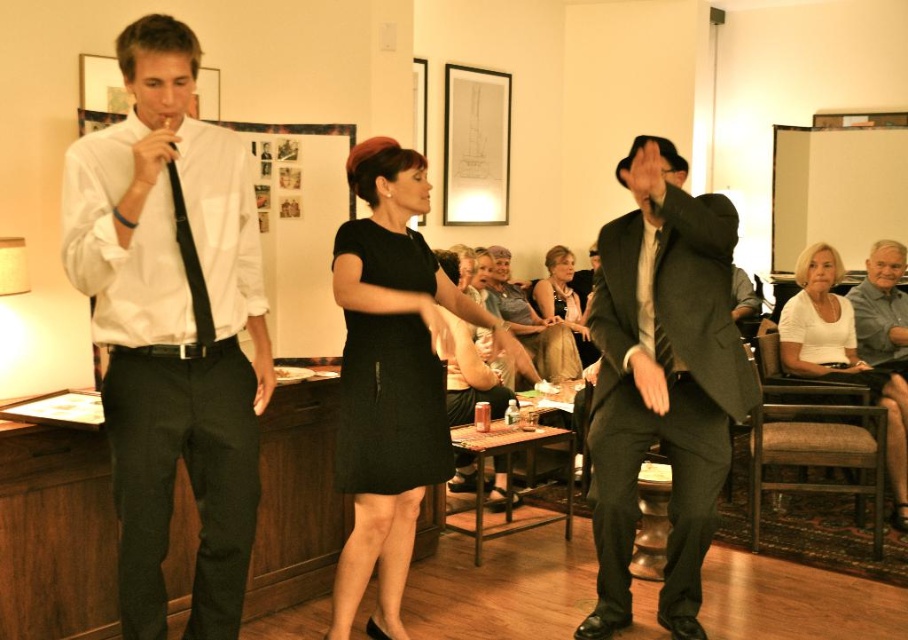
Can you confirm if black dress at center is positioned to the right of black silk tie at center?

Incorrect, black dress at center is not on the right side of black silk tie at center.

Who is more forward, (363, 307) or (655, 228)?

Point (363, 307) is more forward.

I want to click on black dress at center, so coord(391,378).

How far apart are matte black suit at center and black silk tie at center?

matte black suit at center is 10.47 inches away from black silk tie at center.

Can you confirm if matte black suit at center is smaller than black silk tie at center?

Actually, matte black suit at center might be larger than black silk tie at center.

You are a GUI agent. You are given a task and a screenshot of the screen. Output one action in this format:
    pyautogui.click(x=<x>, y=<y>)
    Task: Click on the matte black suit at center
    Image resolution: width=908 pixels, height=640 pixels.
    Given the screenshot: What is the action you would take?
    pyautogui.click(x=662, y=381)

Find the location of `matte black suit at center`. matte black suit at center is located at coordinates point(662,381).

Who is lower down, matte black suit at center or matte black dress at center?

matte black suit at center is lower down.

Which of these two, matte black suit at center or matte black dress at center, stands taller?

matte black suit at center

Between point (637, 376) and point (581, 301), which one is positioned in front?

Point (637, 376) is in front.

Image resolution: width=908 pixels, height=640 pixels. What are the coordinates of `matte black suit at center` in the screenshot? It's located at (662, 381).